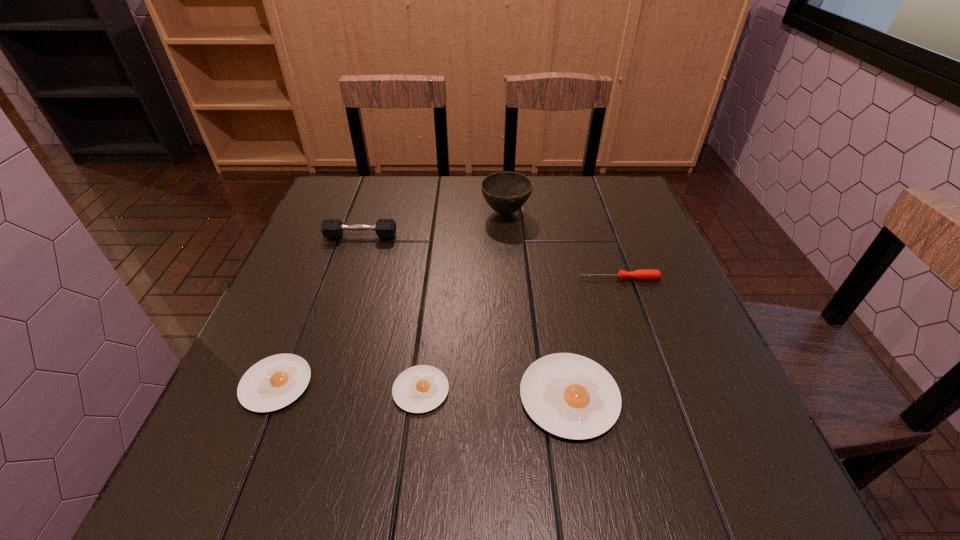
This screenshot has height=540, width=960. In order to click on dumbbell present at the left edge in this screenshot , I will do `click(331, 228)`.

This screenshot has width=960, height=540. Identify the location of object that is at the right edge. (645, 274).

Locate an element on the screen. object that is at the near left corner is located at coordinates (276, 381).

Identify the location of blank space at the far edge of the desktop. (431, 212).

The width and height of the screenshot is (960, 540). What are the coordinates of `vacant space at the near edge of the desktop` in the screenshot? It's located at (476, 403).

Where is `vacant space at the left edge of the desktop`? This screenshot has width=960, height=540. vacant space at the left edge of the desktop is located at coordinates (294, 252).

In the image, there is a desktop. Identify the location of free region at the right edge. The height and width of the screenshot is (540, 960). (645, 344).

In the image, there is a desktop. Where is `vacant space at the far left corner`? vacant space at the far left corner is located at coordinates (356, 215).

Locate an element on the screen. vacant space at the near left corner of the desktop is located at coordinates (306, 409).

Find the location of a particular element. The image size is (960, 540). free spot at the far right corner of the desktop is located at coordinates (590, 198).